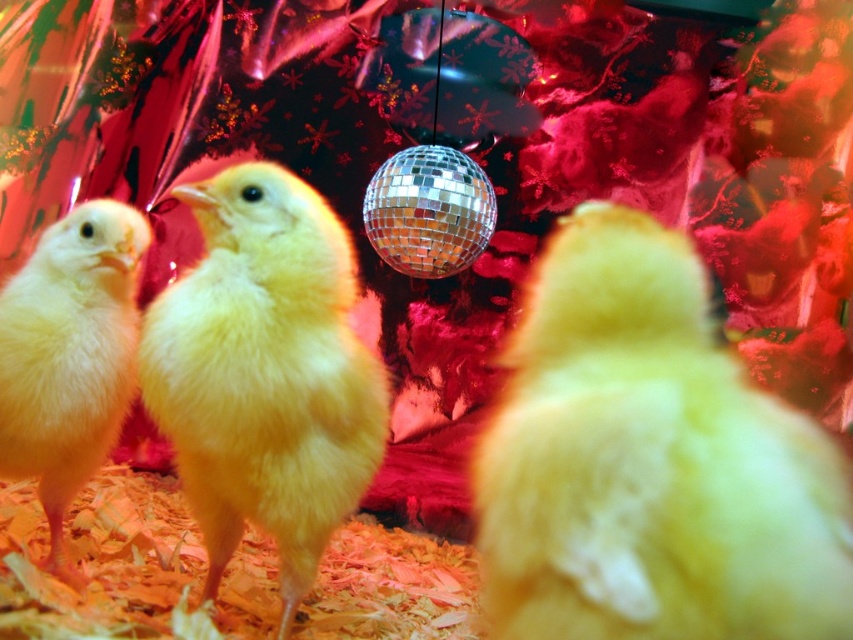
You are holding a small toy that needs to be placed exactly 1 meter away from where you are standing. You see the point at coordinates point (282,365) in the scene. Can you use this point to determine if placing the toy there will meet the requirement?

The point point (282,365) is 1.08 meters from the camera, so placing the toy there would be slightly further than the required 1 meter.

You are a caretaker in a chicken coop and need to place a 24 inch wide feeding tray between the yellow fluffy chick at center and the yellow fluffy chick at left. Can the feeding tray fit between them without overlapping either chick?

The distance between the yellow fluffy chick at center and the yellow fluffy chick at left is 30.04 inches. Since the feeding tray is 24 inches wide, it can fit between them as the space available is larger than the tray.